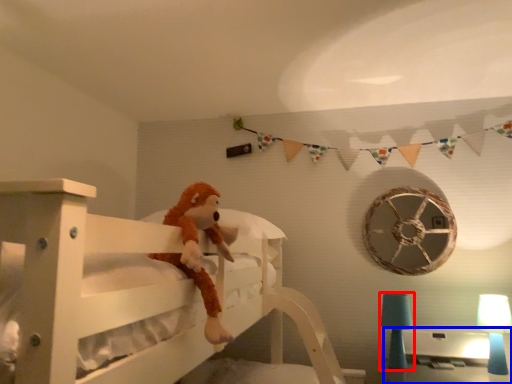
Question: Among these objects, which one is nearest to the camera, table lamp (highlighted by a red box) or table (highlighted by a blue box)?

Choices:
 (A) table lamp
 (B) table

Answer: (A)